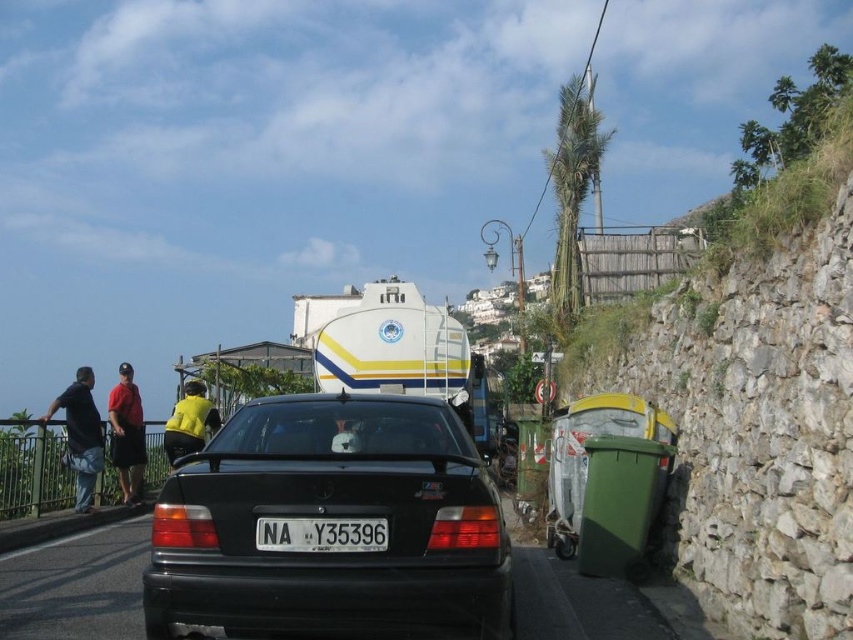
Can you confirm if black matte car at center is wider than matte red shirt at left?

Yes, black matte car at center is wider than matte red shirt at left.

Is black matte car at center above matte red shirt at left?

Yes, black matte car at center is above matte red shirt at left.

Does point (177, 554) come behind point (113, 422)?

That is False.

Identify the location of black matte car at center. (331, 524).

The height and width of the screenshot is (640, 853). Identify the location of black matte car at center. (331, 524).

Between black matte car at center and yellow fabric shirt at upper center, which one appears on the right side from the viewer's perspective?

black matte car at center is more to the right.

This screenshot has height=640, width=853. Describe the element at coordinates (331, 524) in the screenshot. I see `black matte car at center` at that location.

Find the location of `black matte car at center`. black matte car at center is located at coordinates (331, 524).

Who is higher up, white plastic license plate at center or yellow fabric shirt at upper center?

white plastic license plate at center is above.

Is white plastic license plate at center above yellow fabric shirt at upper center?

Yes.

Does point (283, 525) come in front of point (190, 444)?

Yes.

Locate an element on the screen. white plastic license plate at center is located at coordinates (321, 534).